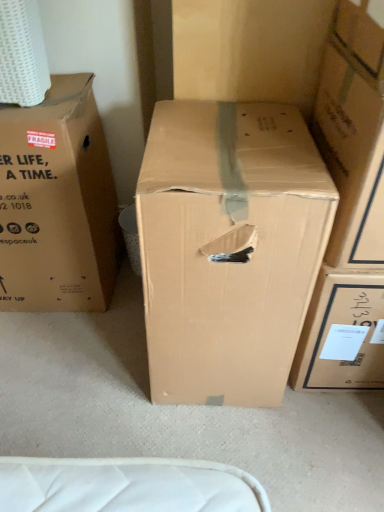
Question: From a real-world perspective, is brown cardboard box at left, positioned as the 1th box in left-to-right order, positioned above or below brown cardboard box at center, which is the 2th box from right to left?

Choices:
 (A) above
 (B) below

Answer: (A)

Question: Is brown cardboard box at left, which is the 3th box from right to left, taller or shorter than brown cardboard box at center, positioned as the second box in left-to-right order?

Choices:
 (A) tall
 (B) short

Answer: (B)

Question: Based on their relative distances, which object is nearer to the cardboard box at center, the 1th box viewed from the right?

Choices:
 (A) brown cardboard box at center, positioned as the second box in left-to-right order
 (B) brown cardboard box at left, positioned as the 1th box in left-to-right order

Answer: (A)

Question: Which of these objects is positioned closest to the cardboard box at center, the 1th box viewed from the right?

Choices:
 (A) brown cardboard box at center, positioned as the second box in left-to-right order
 (B) brown cardboard box at left, positioned as the 1th box in left-to-right order

Answer: (A)